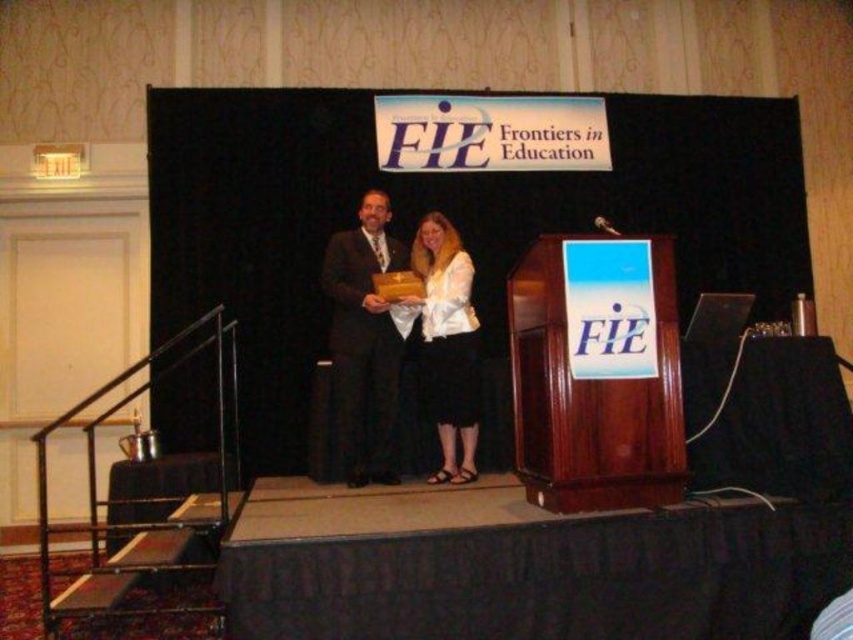
You are attending the FIE Frontiers in Education conference and notice two individuals on stage. The person on the left is wearing a matte black suit at center, and the person on the right is wearing a matte white blouse at center. Based on their positions, which clothing item is covering part of the other?

The matte black suit at center is positioned over the matte white blouse at center, so it is covering part of it.

You are an event photographer positioned at the back of the room. You need to capture a photo of the two individuals on stage, the matte black suit at center and the matte white blouse at center. The camera you are using has a focus range of 30 centimeters. Can you take a clear photo of both subjects without moving your position?

The matte black suit at center and the matte white blouse at center are 31.77 centimeters apart, which exceeds the camera focus range of 30 centimeters. Therefore, you cannot take a clear photo of both subjects without moving your position.

You are attending the FIE Frontiers in Education conference and notice two individuals on stage. The person in the matte black suit at center is presenting an award to the person in the matte white blouse at center. If you were to compare their heights, which individual is taller?

The matte black suit at center is taller than the matte white blouse at center, so the person in the matte black suit at center is taller.